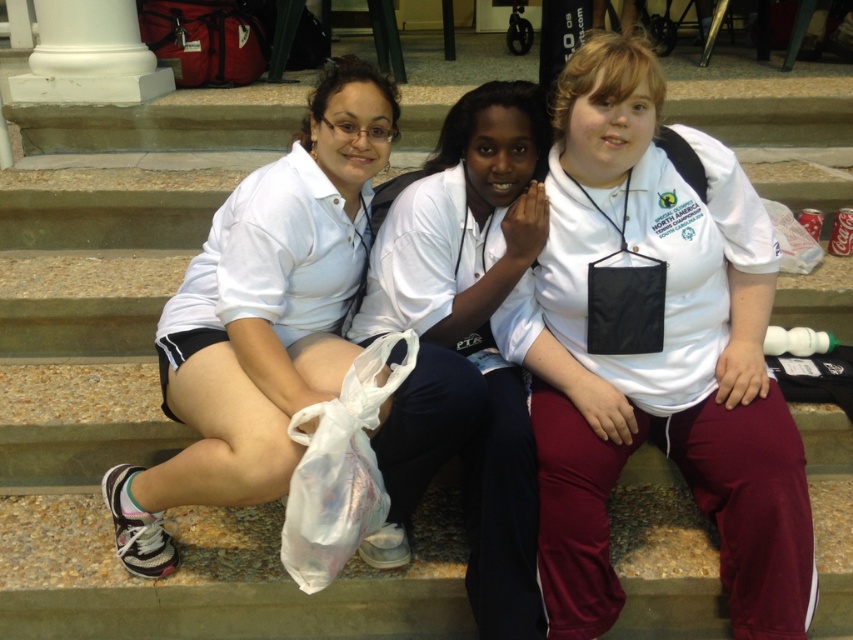
You are a photographer trying to capture a group photo of the white matte shorts at lower left and the white cotton shirt at center. If you want to ensure both subjects are fully visible in the frame, which one requires more horizontal space in the camera view?

The white matte shorts at lower left might require more horizontal space in the camera view since they are wider than the white cotton shirt at center according to the description.

You are standing at the point labeled as point (479, 273) and want to walk to the point labeled as point (173, 406). According to the scene, which direction should you move to reach your destination?

To reach point (173, 406) from point (479, 273), you should move forward since point (173, 406) is in front of point (479, 273).